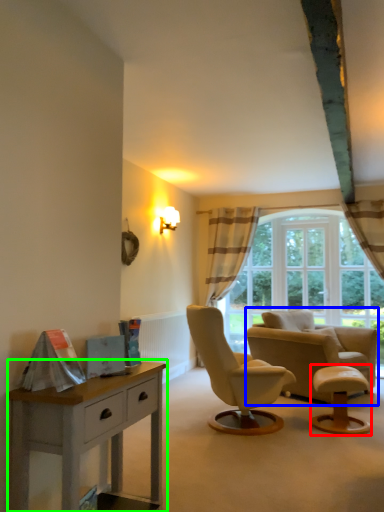
Question: Considering the real-world distances, which object is closest to stool (highlighted by a red box)? chair (highlighted by a blue box) or nightstand (highlighted by a green box).

Choices:
 (A) chair
 (B) nightstand

Answer: (A)